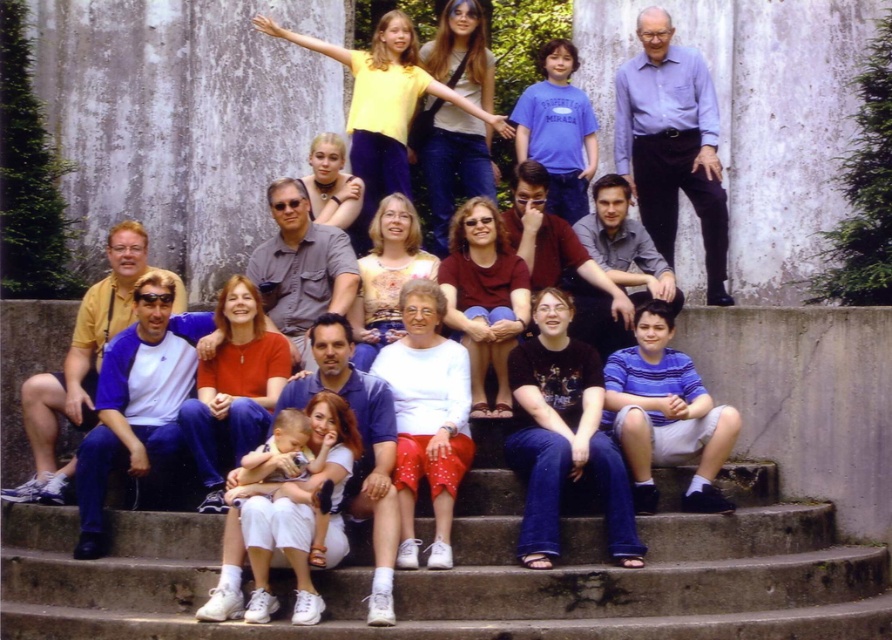
What do you see at coordinates (476, 573) in the screenshot? I see `concrete stairs at lower center` at bounding box center [476, 573].

Can you confirm if concrete stairs at lower center is taller than white cotton shirt at center?

No, concrete stairs at lower center is not taller than white cotton shirt at center.

Where is `concrete stairs at lower center`? The width and height of the screenshot is (892, 640). concrete stairs at lower center is located at coordinates (476, 573).

At what (x,y) coordinates should I click in order to perform the action: click on concrete stairs at lower center. Please return your answer as a coordinate pair (x, y). Looking at the image, I should click on (476, 573).

Between point (684, 83) and point (292, 184), which one is positioned behind?

The point (684, 83) is behind.

Between blue shirt at upper right and denim shirt at center, which one appears on the left side from the viewer's perspective?

From the viewer's perspective, denim shirt at center appears more on the left side.

Locate an element on the screen. blue shirt at upper right is located at coordinates (671, 144).

I want to click on blue shirt at upper right, so click(671, 144).

Who is shorter, white cotton shirt at center or denim shirt at center?

With less height is white cotton shirt at center.

Does white cotton shirt at center appear on the left side of denim shirt at center?

Incorrect, white cotton shirt at center is not on the left side of denim shirt at center.

Is point (269, 612) less distant than point (277, 237)?

That is True.

Where is `white cotton shirt at center`? white cotton shirt at center is located at coordinates (x=296, y=502).